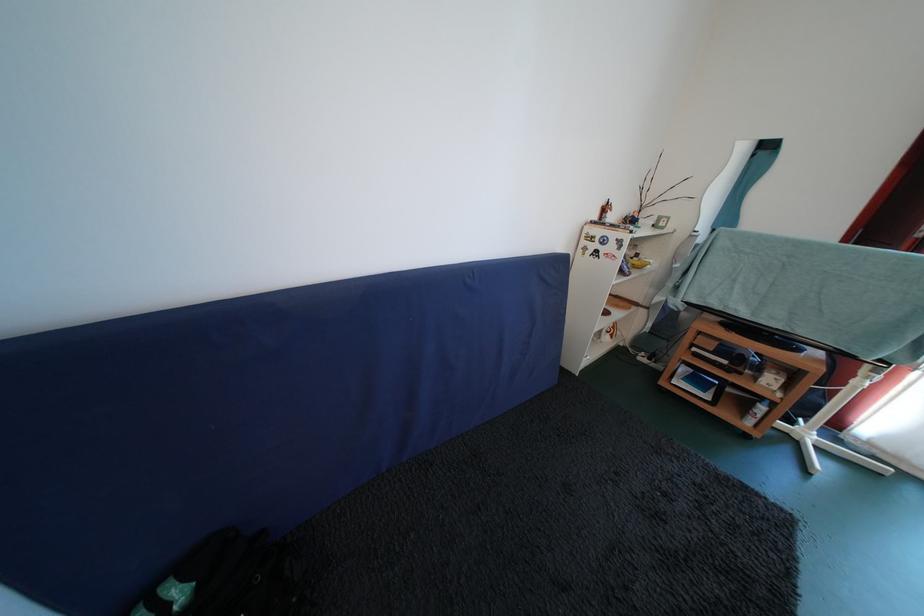
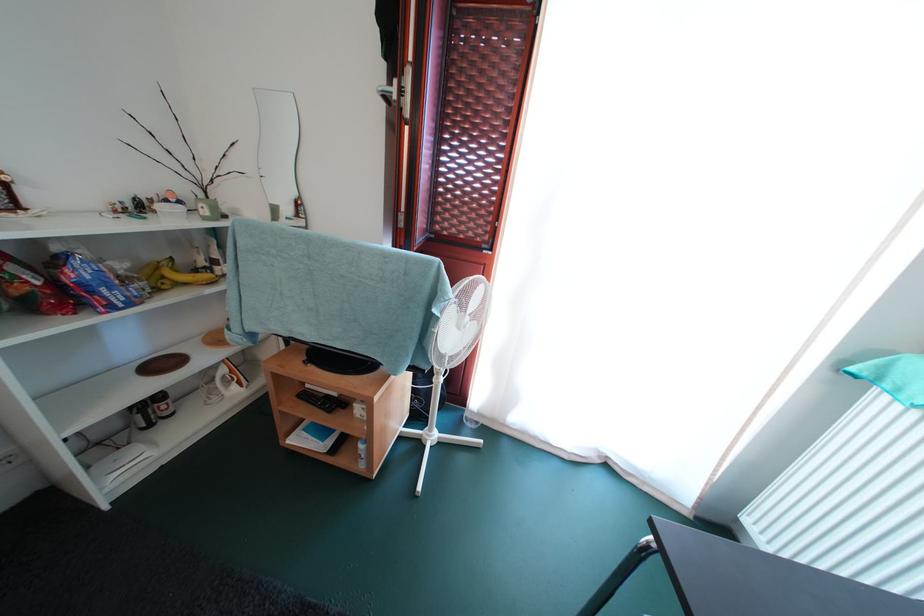
Where in the second image is the point corresponding to [749,318] from the first image?

(318, 341)